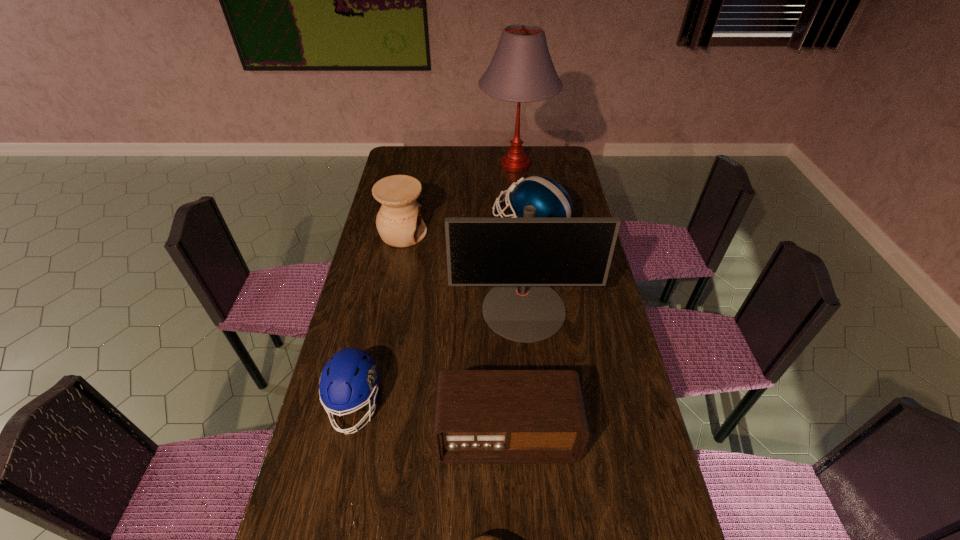
You are a GUI agent. You are given a task and a screenshot of the screen. Output one action in this format:
    pyautogui.click(x=<x>, y=<y>)
    Task: Click on the table lamp
    This screenshot has height=540, width=960.
    Given the screenshot: What is the action you would take?
    pyautogui.click(x=521, y=70)

You are a GUI agent. You are given a task and a screenshot of the screen. Output one action in this format:
    pyautogui.click(x=<x>, y=<y>)
    Task: Click on the tallest object
    The image size is (960, 540).
    Given the screenshot: What is the action you would take?
    pyautogui.click(x=521, y=70)

Locate an element on the screen. the fourth nearest object is located at coordinates (521, 257).

The width and height of the screenshot is (960, 540). I want to click on computer monitor, so click(x=521, y=257).

The height and width of the screenshot is (540, 960). I want to click on the right football helmet, so (x=551, y=200).

Locate an element on the screen. This screenshot has height=540, width=960. the taller football helmet is located at coordinates (551, 200).

Where is `pottery`? The height and width of the screenshot is (540, 960). pottery is located at coordinates (399, 222).

Where is `radio receiver`? radio receiver is located at coordinates (481, 416).

Locate an element on the screen. The width and height of the screenshot is (960, 540). the left football helmet is located at coordinates (350, 378).

The image size is (960, 540). Identify the location of the nearer football helmet. (350, 378).